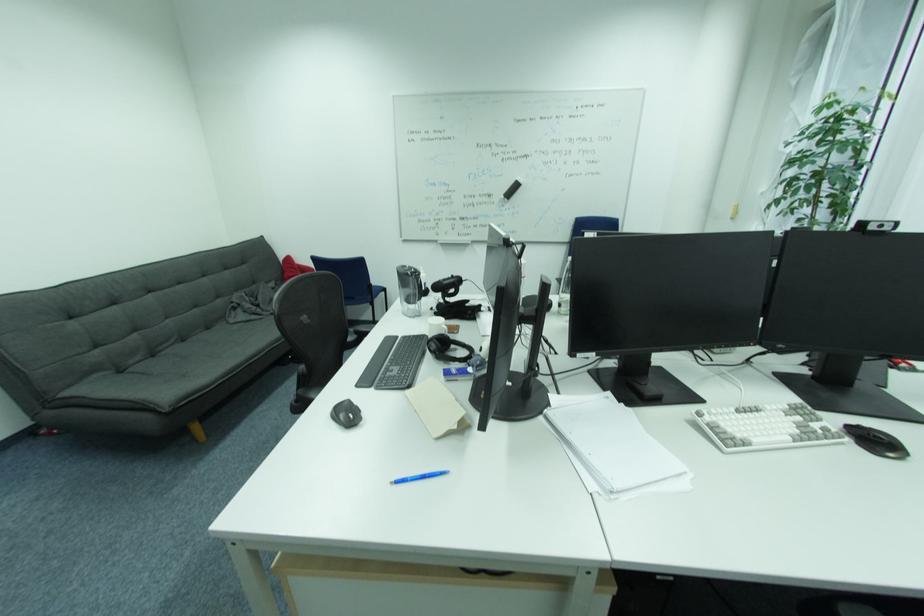
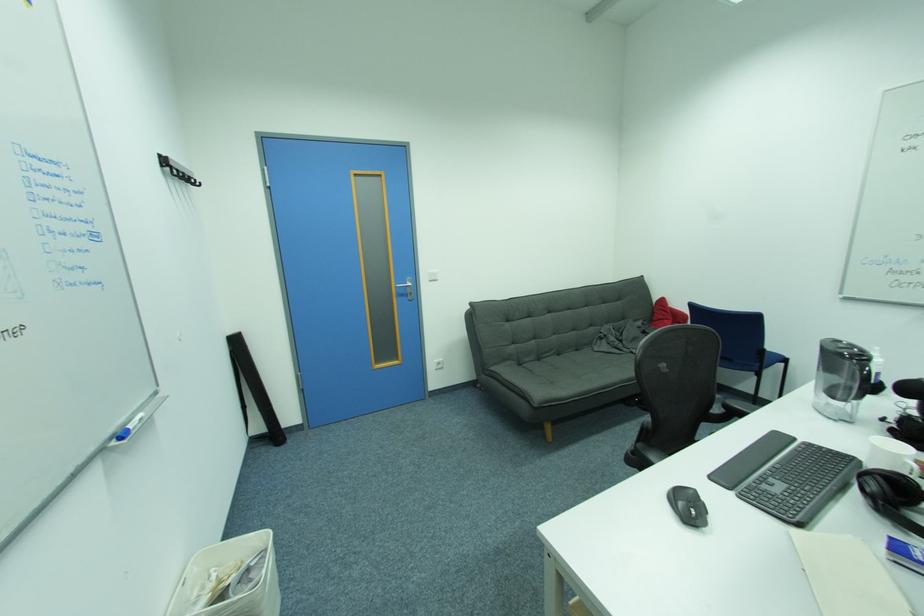
Question: The camera is either moving clockwise (left) or counter-clockwise (right) around the object. The first image is from the beginning of the video and the second image is from the end. Is the camera moving left or right when shooting the video?

Choices:
 (A) Left
 (B) Right

Answer: (B)